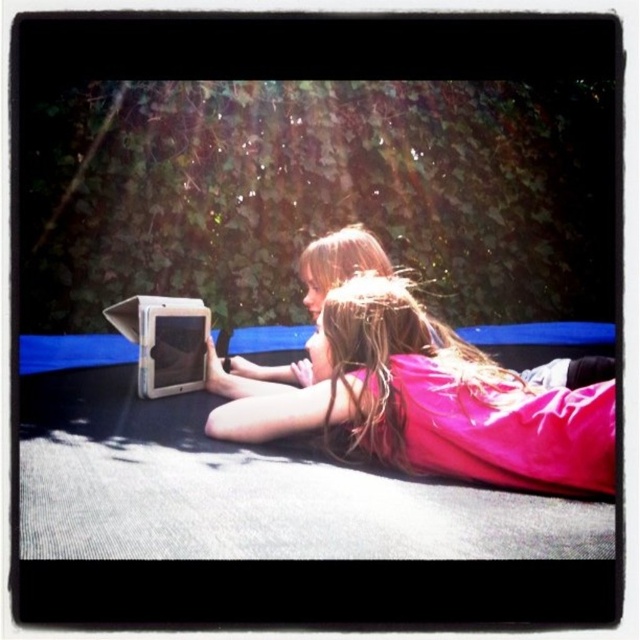
Does point (236, 397) lie behind point (340, 230)?

That is False.

The image size is (640, 640). What do you see at coordinates (424, 401) in the screenshot? I see `pink fabric at center` at bounding box center [424, 401].

Locate an element on the screen. Image resolution: width=640 pixels, height=640 pixels. pink fabric at center is located at coordinates (424, 401).

Is point (355, 273) behind point (147, 336)?

Yes, it is.

Can you confirm if pink satin dress at center is smaller than matte white laptop at center?

Incorrect, pink satin dress at center is not smaller in size than matte white laptop at center.

Locate an element on the screen. pink satin dress at center is located at coordinates (339, 262).

The width and height of the screenshot is (640, 640). In order to click on pink satin dress at center in this screenshot , I will do `click(339, 262)`.

Is pink fabric at center to the right of matte white laptop at center from the viewer's perspective?

Indeed, pink fabric at center is positioned on the right side of matte white laptop at center.

This screenshot has width=640, height=640. What are the coordinates of `pink fabric at center` in the screenshot? It's located at (424, 401).

The image size is (640, 640). Find the location of `pink fabric at center`. pink fabric at center is located at coordinates (424, 401).